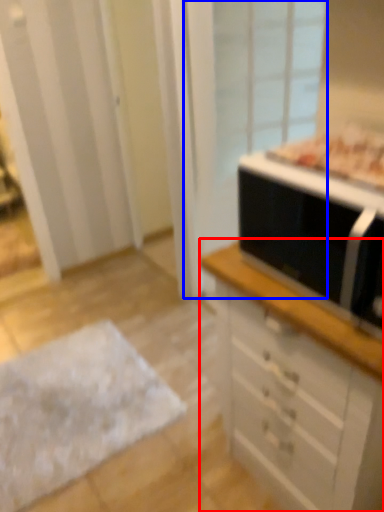
Question: Which object is further to the camera taking this photo, chest of drawers (highlighted by a red box) or screen door (highlighted by a blue box)?

Choices:
 (A) chest of drawers
 (B) screen door

Answer: (B)